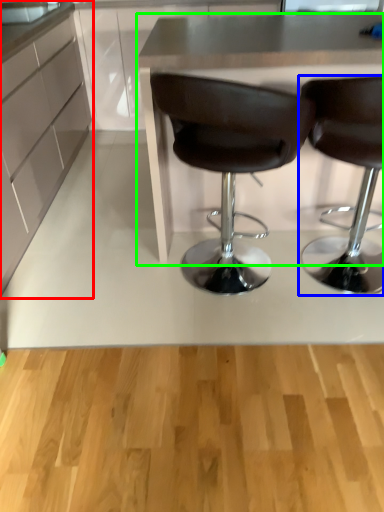
Question: Which is nearer to the cabinetry (highlighted by a red box)? chair (highlighted by a blue box) or table (highlighted by a green box).

Choices:
 (A) chair
 (B) table

Answer: (B)